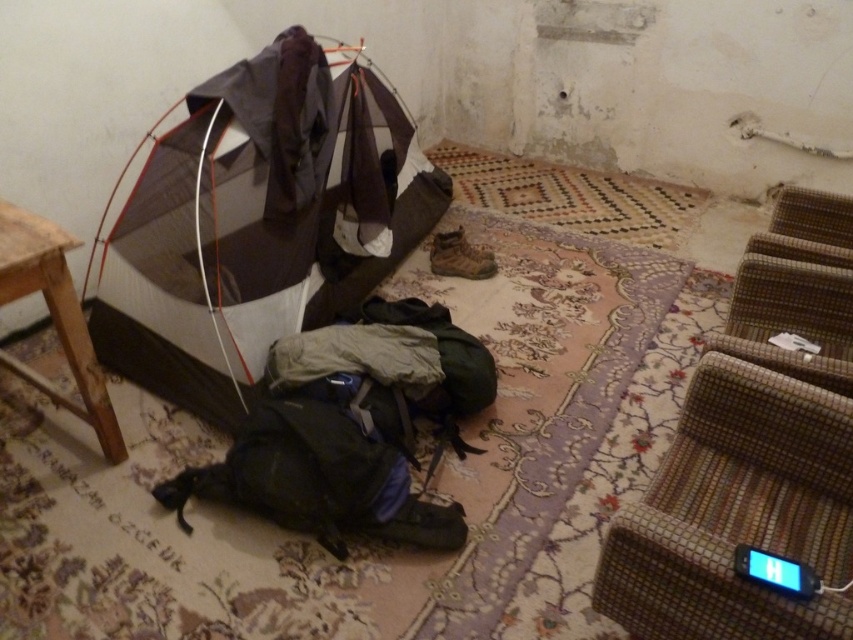
You are standing in the room and want to place a 6 feet long ladder against the wall behind the black fabric sleeping bag at center. Can you fit the ladder there without moving the sleeping bag?

The distance between you and the black fabric sleeping bag at center is 5.75 feet. Since the ladder is 6 feet long, it would extend beyond the sleeping bag by 0.25 feet. However, the ladder requires a clear vertical space. The scene description mentions the tent is partially set up in the center, so there might be obstructions. Therefore, it might not be possible without moving the sleeping bag.

You are setting up a camping area in the room. You have a gray fabric tent at center and a black fabric sleeping bag at center. Which object is positioned to the left side of the other?

The gray fabric tent at center is to the left of the black fabric sleeping bag at center.

You are setting up a camping area in this room. You have a black fabric sleeping bag at center and a wooden stool at lower left. Which item is shorter in height?

The black fabric sleeping bag at center is shorter than the wooden stool at lower left.